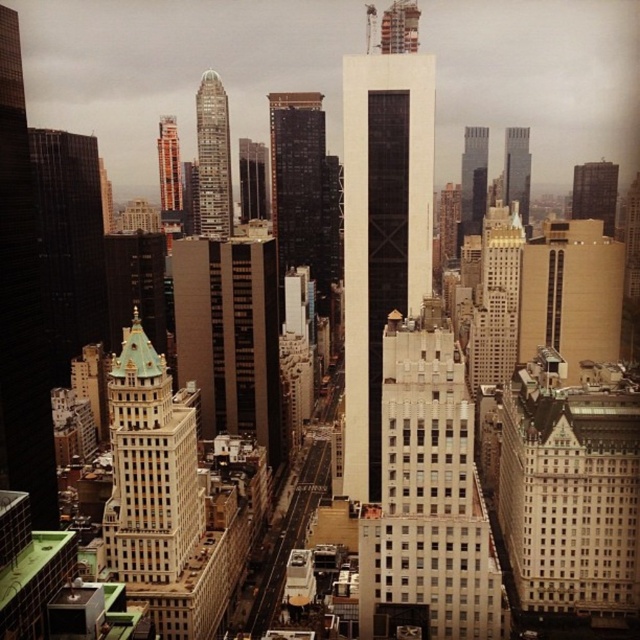
You are an urban planner analyzing the city layout. You need to determine the relative positioning of the white textured building at center and the matte glass skyscraper at upper right. From the perspective of someone standing at the center of the image, which building is located to the right?

The white textured building at center is positioned on the left side of matte glass skyscraper at upper right, so from the center of the image, the matte glass skyscraper at upper right is to the right of the white textured building at center.